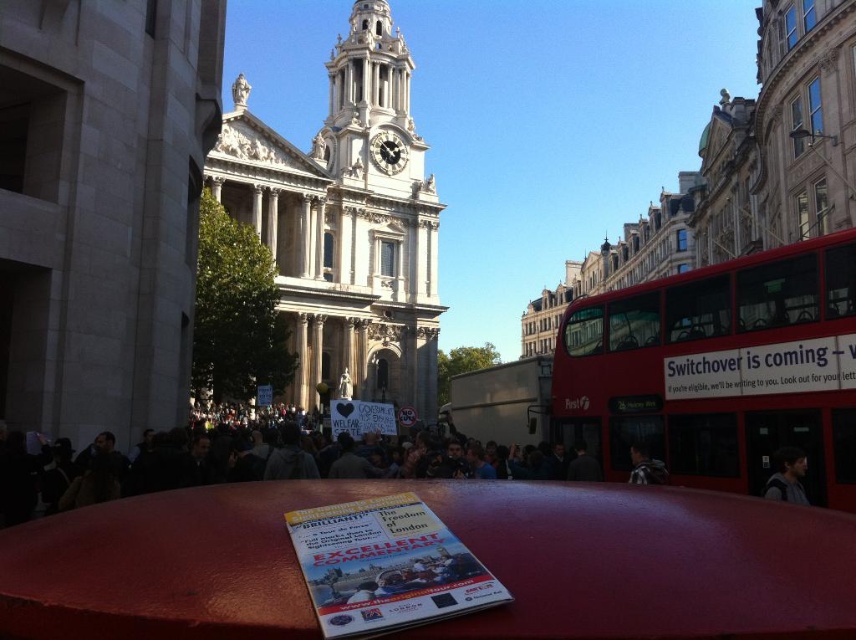
You are a tourist in London holding a map and looking at the scene. You want to know which object is bigger between the red metallic bus at right and the dark gray fabric jacket at lower right. Can you tell me?

The red metallic bus at right has a larger size compared to the dark gray fabric jacket at lower right, so the red metallic bus at right is bigger.